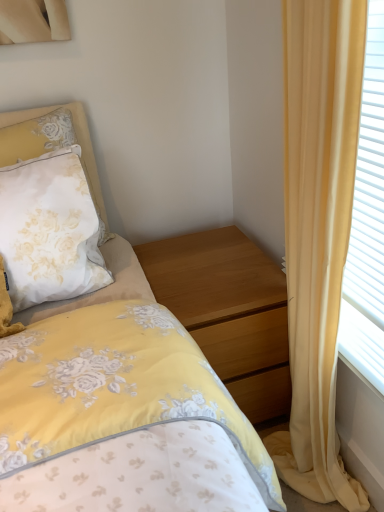
Question: Is yellow fabric curtain at right turned away from wooden nightstand at center?

Choices:
 (A) yes
 (B) no

Answer: (B)

Question: Is yellow fabric curtain at right bigger than wooden nightstand at center?

Choices:
 (A) yes
 (B) no

Answer: (B)

Question: Is yellow fabric curtain at right positioned before wooden nightstand at center?

Choices:
 (A) yes
 (B) no

Answer: (A)

Question: Does yellow fabric curtain at right appear on the right side of wooden nightstand at center?

Choices:
 (A) yes
 (B) no

Answer: (A)

Question: From a real-world perspective, is yellow fabric curtain at right located higher than wooden nightstand at center?

Choices:
 (A) yes
 (B) no

Answer: (A)

Question: From a real-world perspective, is white satin pillow at upper left positioned above or below wooden nightstand at center?

Choices:
 (A) below
 (B) above

Answer: (B)

Question: From the image's perspective, is white satin pillow at upper left above or below wooden nightstand at center?

Choices:
 (A) above
 (B) below

Answer: (A)

Question: Considering the positions of white satin pillow at upper left and wooden nightstand at center in the image, is white satin pillow at upper left wider or thinner than wooden nightstand at center?

Choices:
 (A) thin
 (B) wide

Answer: (A)

Question: In terms of size, does white satin pillow at upper left appear bigger or smaller than wooden nightstand at center?

Choices:
 (A) small
 (B) big

Answer: (A)

Question: Is yellow fabric curtain at right inside the boundaries of white satin pillow at upper left, or outside?

Choices:
 (A) inside
 (B) outside

Answer: (B)

Question: From their relative heights in the image, would you say yellow fabric curtain at right is taller or shorter than white satin pillow at upper left?

Choices:
 (A) short
 (B) tall

Answer: (B)

Question: Relative to white satin pillow at upper left, is yellow fabric curtain at right in front or behind?

Choices:
 (A) behind
 (B) front

Answer: (B)

Question: From a real-world perspective, is yellow fabric curtain at right positioned above or below white satin pillow at upper left?

Choices:
 (A) above
 (B) below

Answer: (B)

Question: Is wooden nightstand at center spatially inside yellow fabric curtain at right, or outside of it?

Choices:
 (A) outside
 (B) inside

Answer: (A)

Question: Would you say wooden nightstand at center is to the left or to the right of yellow fabric curtain at right in the picture?

Choices:
 (A) left
 (B) right

Answer: (A)